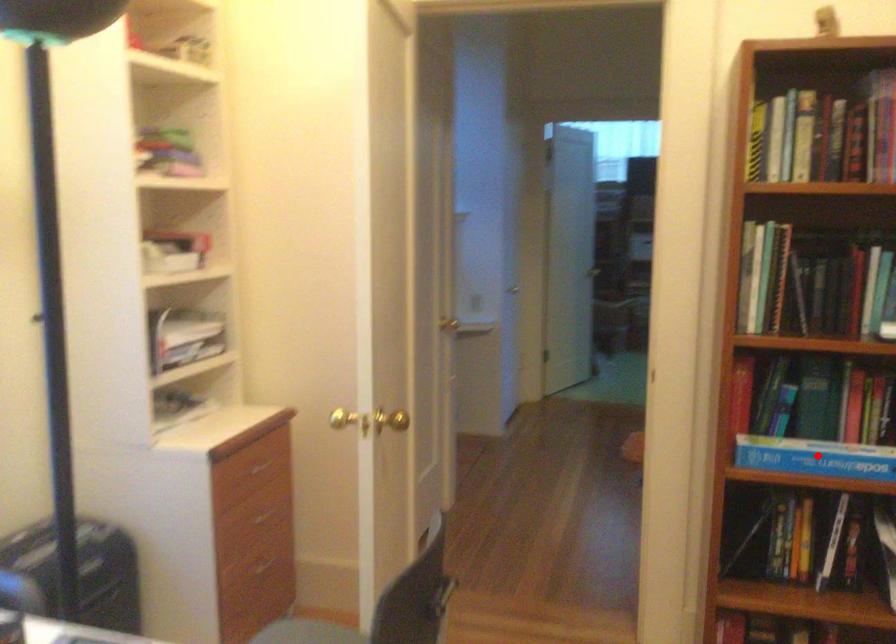
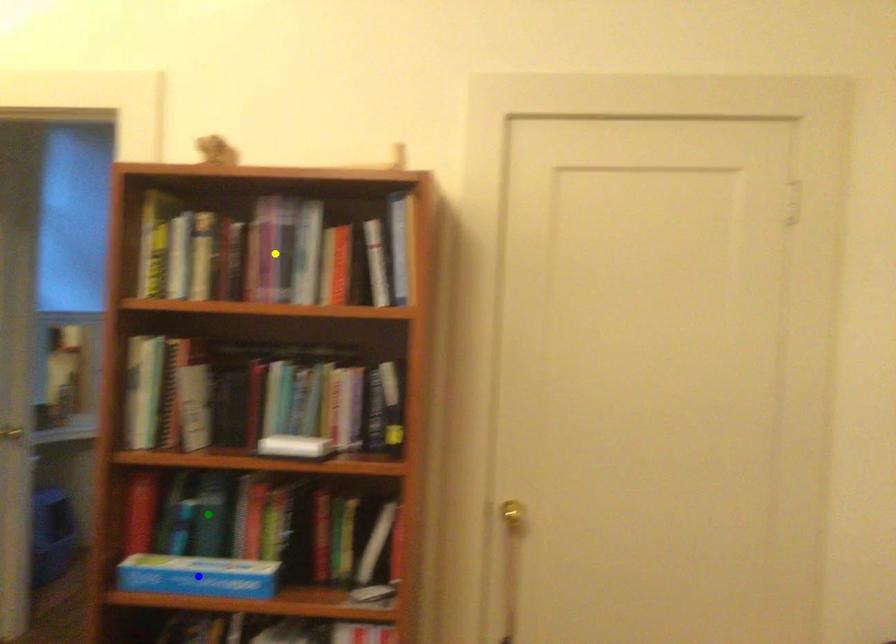
Question: I am providing you with two images of the same scene from different viewpoints. A red point is marked on the first image. You are given multiple points on the second image. Which spot in image 2 lines up with the point in image 1?

Choices:
 (A) blue point
 (B) green point
 (C) yellow point

Answer: (A)